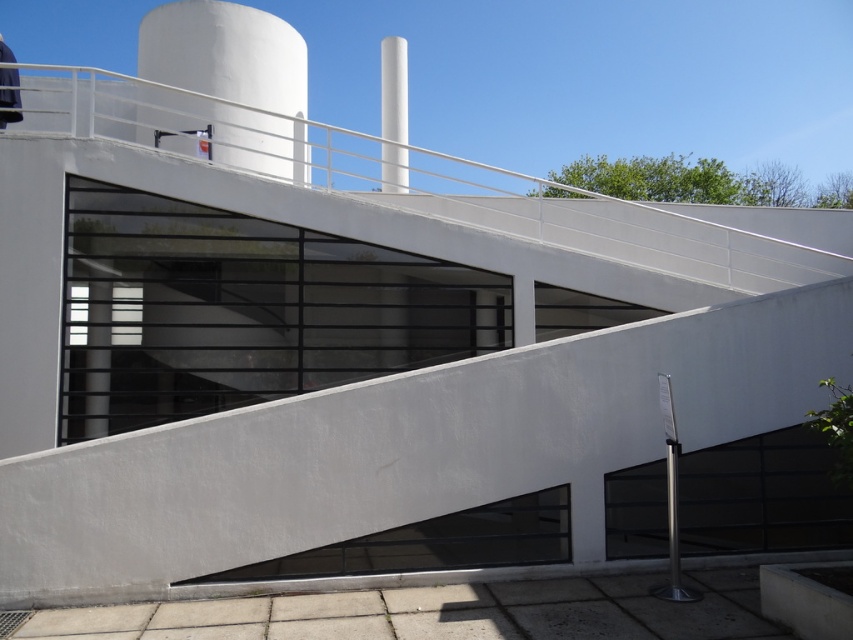
Question: Which of the following is the farthest from the observer?

Choices:
 (A) white smooth water tower at upper center
 (B) white smooth pillar at upper center

Answer: (B)

Question: Which object is farther from the camera taking this photo?

Choices:
 (A) white smooth pillar at upper center
 (B) white smooth water tower at upper center

Answer: (A)

Question: Can you confirm if white smooth water tower at upper center is wider than white smooth pillar at upper center?

Choices:
 (A) no
 (B) yes

Answer: (B)

Question: Observing the image, what is the correct spatial positioning of white smooth water tower at upper center in reference to white smooth pillar at upper center?

Choices:
 (A) left
 (B) right

Answer: (A)

Question: Does white smooth water tower at upper center have a larger size compared to white smooth pillar at upper center?

Choices:
 (A) no
 (B) yes

Answer: (A)

Question: Which point is farther from the camera taking this photo?

Choices:
 (A) (175, 84)
 (B) (405, 116)

Answer: (B)